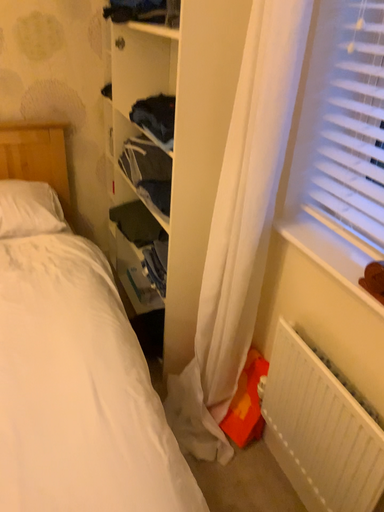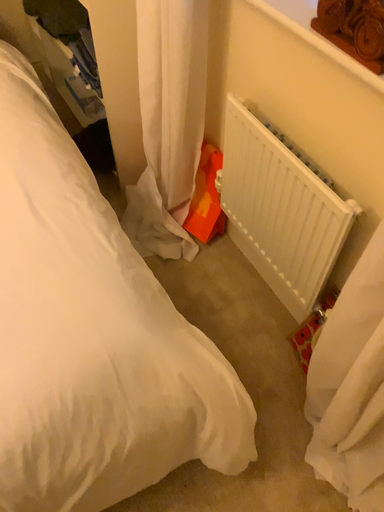
Question: Which way did the camera rotate in the video?

Choices:
 (A) rotated upward
 (B) rotated downward

Answer: (B)